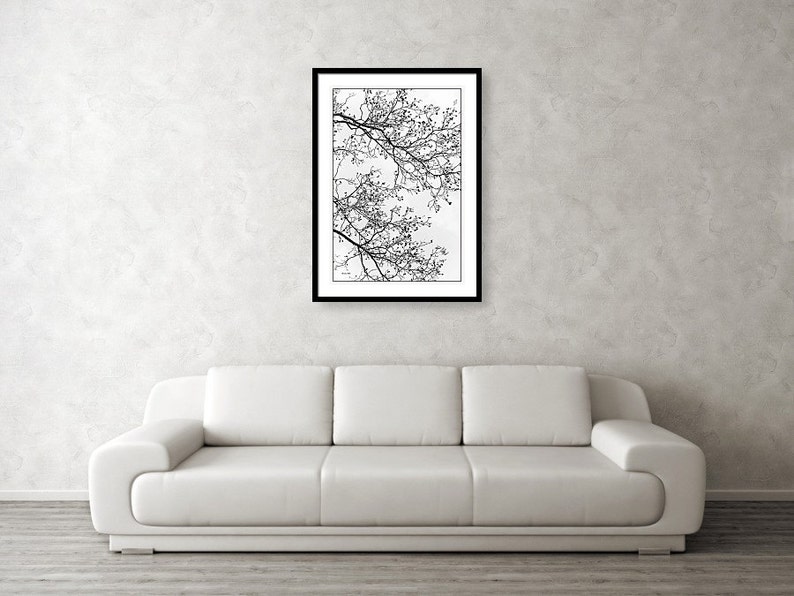
I want to click on front couch, so click(x=137, y=544), click(x=626, y=542), click(x=434, y=547), click(x=303, y=547).